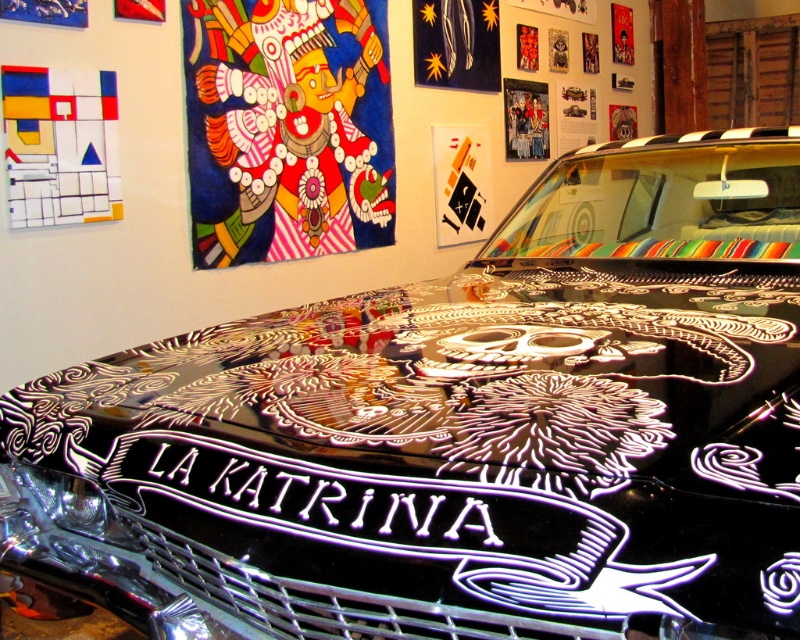
Question: Which point appears farthest from the camera in this image?

Choices:
 (A) (214, 38)
 (B) (50, 172)

Answer: (A)

Question: Which of the following is the farthest from the observer?

Choices:
 (A) vibrant painted mask at upper left
 (B) matte white geometric shapes at upper left

Answer: (A)

Question: Can you confirm if vibrant painted mask at upper left is thinner than matte white geometric shapes at upper left?

Choices:
 (A) yes
 (B) no

Answer: (B)

Question: Which point is closer to the camera?

Choices:
 (A) matte white geometric shapes at upper left
 (B) vibrant painted mask at upper left

Answer: (A)

Question: Does vibrant painted mask at upper left appear on the left side of matte white geometric shapes at upper left?

Choices:
 (A) no
 (B) yes

Answer: (A)

Question: Does vibrant painted mask at upper left appear under matte white geometric shapes at upper left?

Choices:
 (A) no
 (B) yes

Answer: (A)